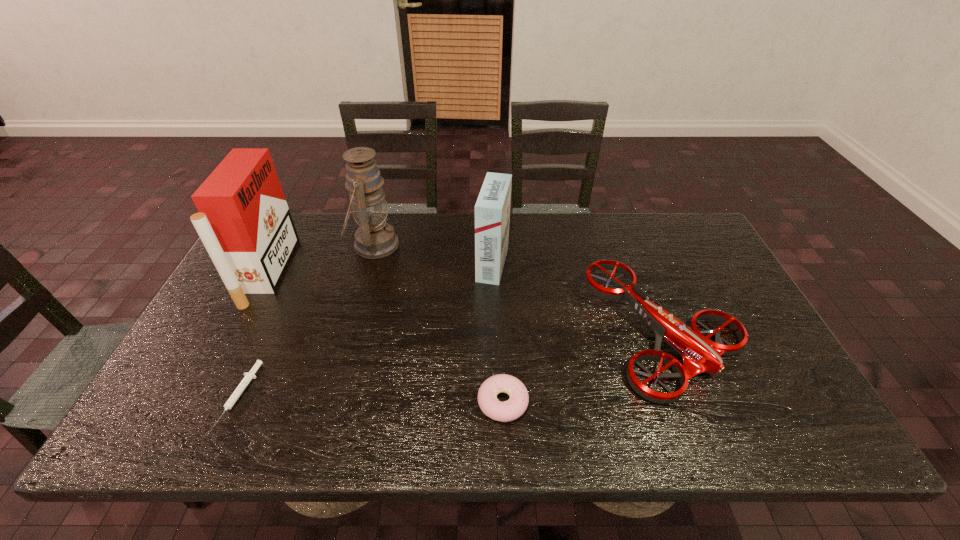
The height and width of the screenshot is (540, 960). I want to click on oil lamp, so click(375, 238).

Where is `the left cigarette case`? This screenshot has height=540, width=960. the left cigarette case is located at coordinates (244, 222).

Identify the location of the leftmost object. Image resolution: width=960 pixels, height=540 pixels. (244, 222).

Locate an element on the screen. This screenshot has height=540, width=960. the shorter cigarette case is located at coordinates (492, 210).

The width and height of the screenshot is (960, 540). What are the coordinates of `the right cigarette case` in the screenshot? It's located at [492, 210].

Locate an element on the screen. Image resolution: width=960 pixels, height=540 pixels. the rightmost object is located at coordinates (699, 354).

In order to click on the third shortest object in this screenshot , I will do click(x=699, y=354).

This screenshot has height=540, width=960. I want to click on doughnut, so click(509, 410).

Locate an element on the screen. This screenshot has width=960, height=540. syringe is located at coordinates [x=236, y=394].

You are a GUI agent. You are given a task and a screenshot of the screen. Output one action in this format:
    pyautogui.click(x=<x>, y=<y>)
    Task: Click on the fifth object from right to left
    The height and width of the screenshot is (540, 960).
    Given the screenshot: What is the action you would take?
    (x=236, y=394)